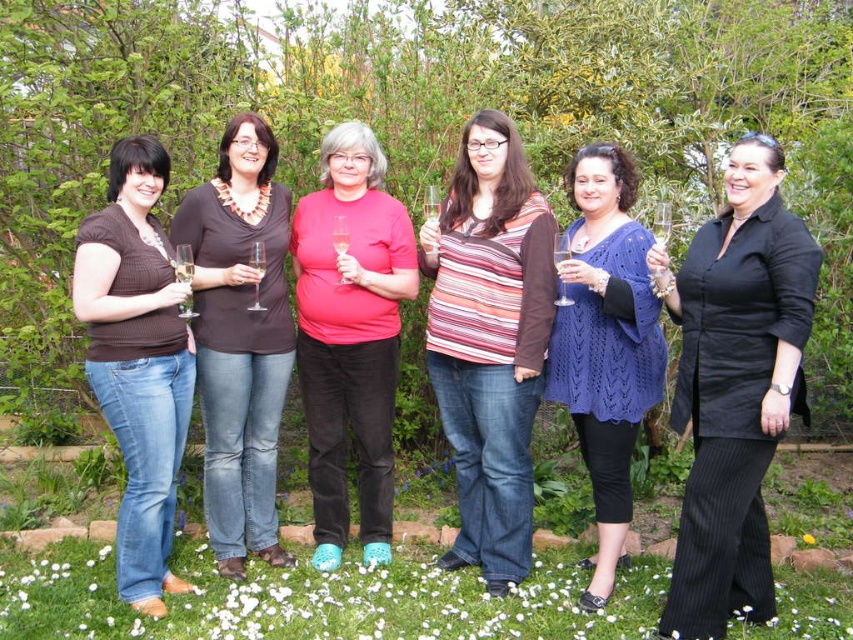
Does white fabric flower at lower center have a greater height compared to yellow fabric flower at center?

Yes, white fabric flower at lower center is taller than yellow fabric flower at center.

Is white fabric flower at lower center to the left of yellow fabric flower at center from the viewer's perspective?

Correct, you'll find white fabric flower at lower center to the left of yellow fabric flower at center.

What are the coordinates of `white fabric flower at lower center` in the screenshot? It's located at (320, 602).

Find the location of `white fabric flower at lower center`. white fabric flower at lower center is located at coordinates (320, 602).

Can you confirm if matte brown blouse at center is taller than matte brown shirt at left?

Correct, matte brown blouse at center is much taller as matte brown shirt at left.

Based on the photo, is matte brown blouse at center positioned at the back of matte brown shirt at left?

That is True.

Image resolution: width=853 pixels, height=640 pixels. Describe the element at coordinates (241, 339) in the screenshot. I see `matte brown blouse at center` at that location.

Where is `matte brown blouse at center`? The height and width of the screenshot is (640, 853). matte brown blouse at center is located at coordinates (241, 339).

From the picture: Does black pinstripe dress at right appear over matte brown shirt at left?

Actually, black pinstripe dress at right is below matte brown shirt at left.

Is black pinstripe dress at right taller than matte brown shirt at left?

No, black pinstripe dress at right is not taller than matte brown shirt at left.

Which is behind, point (721, 442) or point (109, 202)?

Positioned behind is point (109, 202).

Identify the location of black pinstripe dress at right. The height and width of the screenshot is (640, 853). (735, 387).